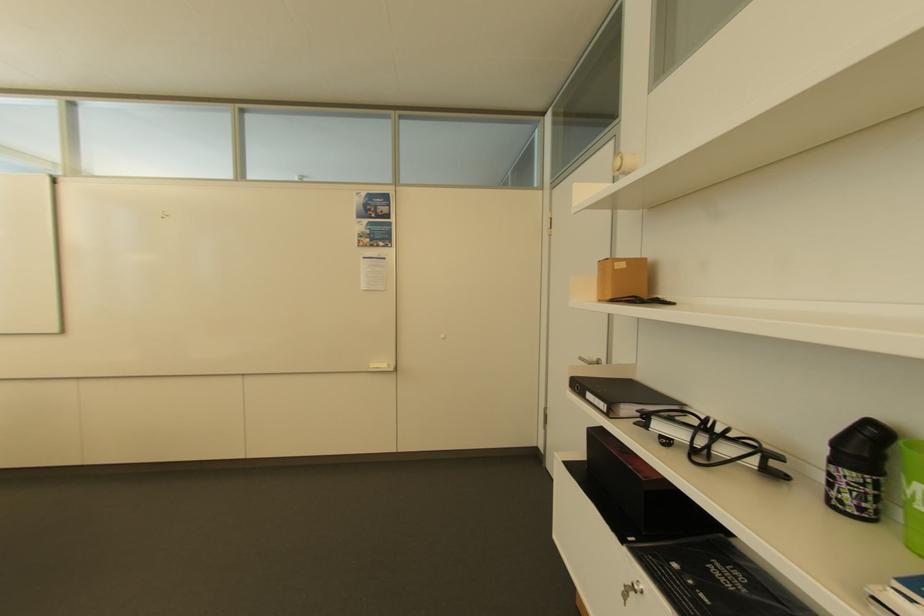
Find where to open the black binder. Please return your answer as a coordinate pair (x, y).

(617, 382)